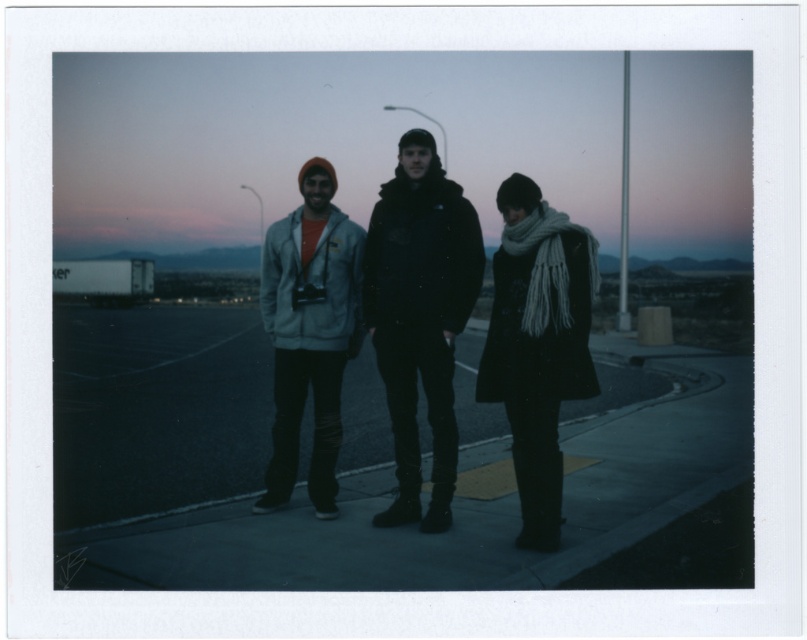
Question: Is dark asphalt pavement at center closer to camera compared to black wool coat at center?

Choices:
 (A) yes
 (B) no

Answer: (A)

Question: Which point is closer to the camera?

Choices:
 (A) dark asphalt pavement at center
 (B) black matte jacket at center

Answer: (A)

Question: Which point is farther to the camera?

Choices:
 (A) (400, 509)
 (B) (525, 468)
 (C) (281, 253)

Answer: (C)

Question: Which object is farther from the camera taking this photo?

Choices:
 (A) black wool coat at center
 (B) knitted scarf at center

Answer: (A)

Question: Is dark asphalt pavement at center thinner than matte gray hoodie at center?

Choices:
 (A) no
 (B) yes

Answer: (A)

Question: Considering the relative positions of black wool coat at center and black matte jacket at center in the image provided, where is black wool coat at center located with respect to black matte jacket at center?

Choices:
 (A) left
 (B) right

Answer: (B)